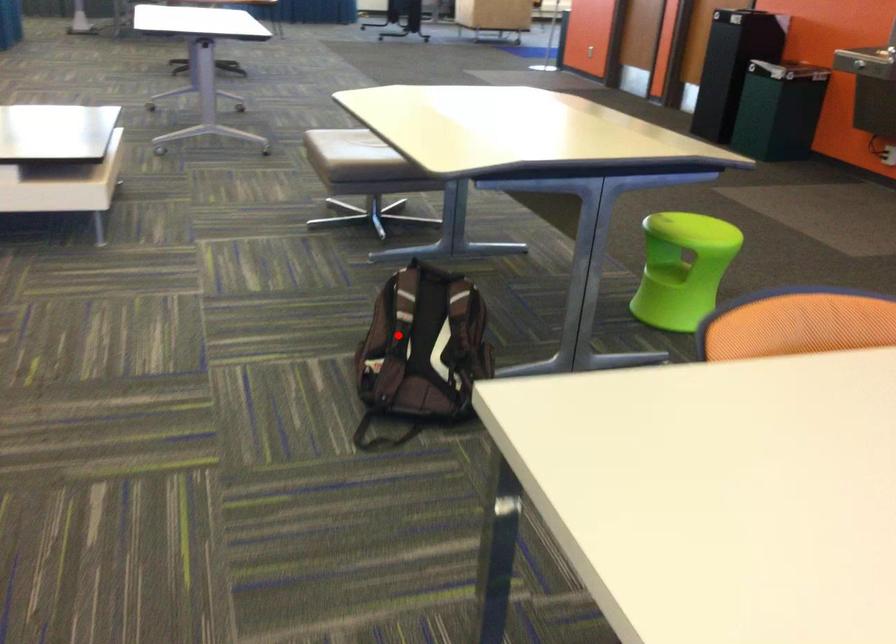
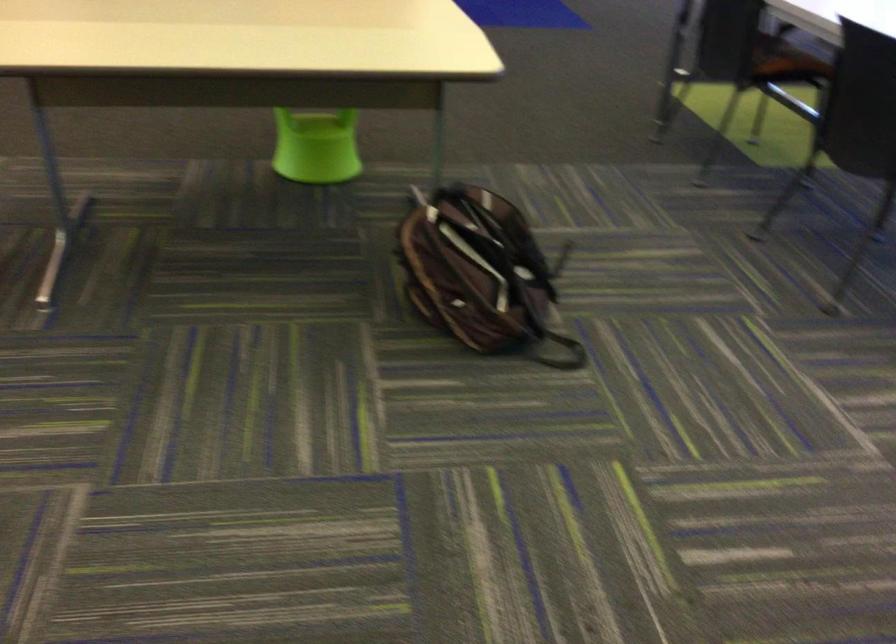
In the second image, find the point that corresponds to the highlighted location in the first image.

(479, 272)